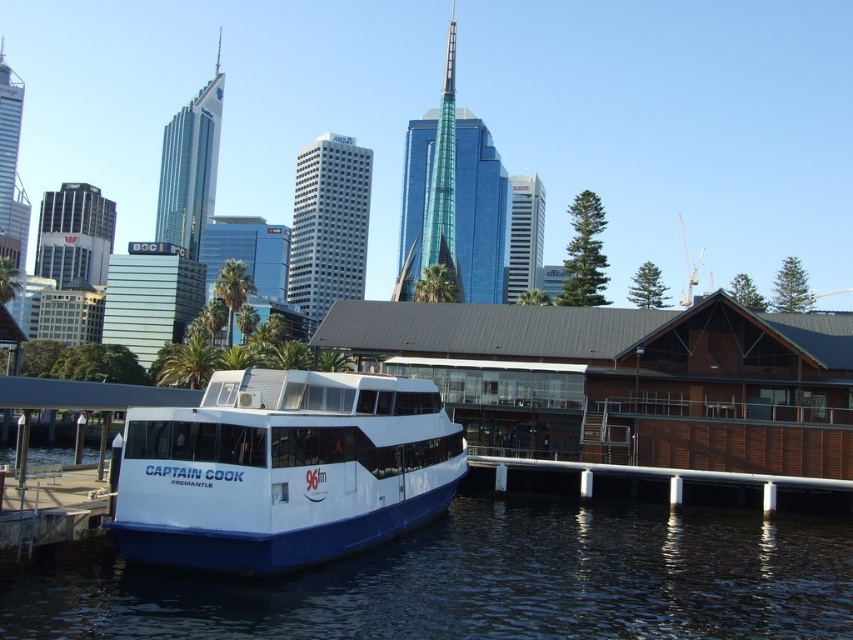
Question: Does transparent blue water at lower center have a lesser width compared to white glossy boat at center?

Choices:
 (A) yes
 (B) no

Answer: (B)

Question: Which object appears farthest from the camera in this image?

Choices:
 (A) white glossy boat at center
 (B) transparent blue water at lower center

Answer: (A)

Question: Observing the image, what is the correct spatial positioning of transparent blue water at lower center in reference to white glossy boat at center?

Choices:
 (A) right
 (B) left

Answer: (A)

Question: Is transparent blue water at lower center positioned before white glossy boat at center?

Choices:
 (A) no
 (B) yes

Answer: (B)

Question: Among these objects, which one is farthest from the camera?

Choices:
 (A) transparent blue water at lower center
 (B) white glossy boat at center

Answer: (B)